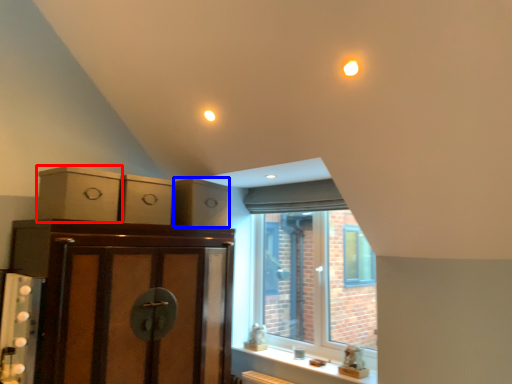
Question: Among these objects, which one is nearest to the camera, cabinetry (highlighted by a red box) or drawer (highlighted by a blue box)?

Choices:
 (A) cabinetry
 (B) drawer

Answer: (A)